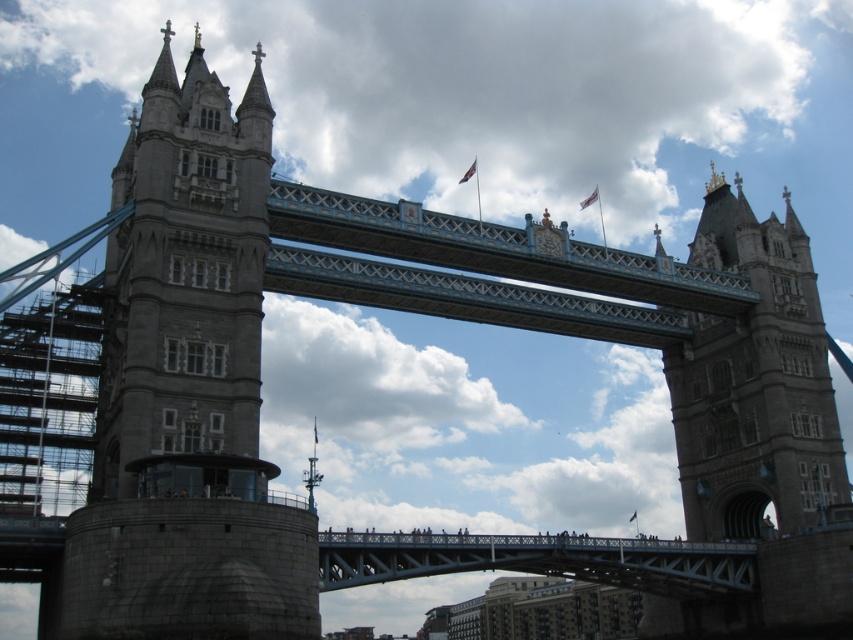
Question: Which of the following is the farthest from the observer?

Choices:
 (A) stone gray tower at center
 (B) white fluffy cloud at center
 (C) white fluffy cloud at upper center
 (D) gray stone tower bridge at left

Answer: (B)

Question: Which point is closer to the camera?

Choices:
 (A) (213, 424)
 (B) (309, 364)
 (C) (693, 8)
 (D) (817, 346)

Answer: (A)

Question: Among these objects, which one is farthest from the camera?

Choices:
 (A) gray stone tower bridge at left
 (B) white fluffy cloud at center

Answer: (B)

Question: Is gray stone tower bridge at left further to camera compared to white fluffy cloud at center?

Choices:
 (A) yes
 (B) no

Answer: (B)

Question: Is white fluffy cloud at upper center wider than white fluffy cloud at center?

Choices:
 (A) no
 (B) yes

Answer: (B)

Question: Can you confirm if white fluffy cloud at upper center is positioned to the right of gray stone tower bridge at left?

Choices:
 (A) yes
 (B) no

Answer: (A)